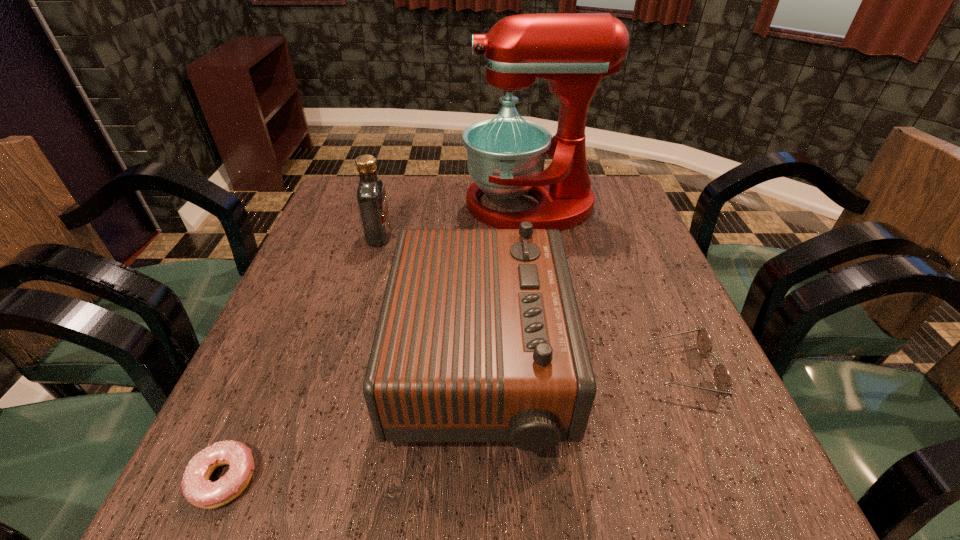
Locate an element on the screen. Image resolution: width=960 pixels, height=540 pixels. vacant position at the far right corner of the desktop is located at coordinates (619, 217).

Image resolution: width=960 pixels, height=540 pixels. Identify the location of vacant area at the near right corner. (734, 505).

I want to click on free space between the second object from left to right and the shortest object, so click(301, 357).

Where is `blank region between the mixer and the vodka`? Image resolution: width=960 pixels, height=540 pixels. blank region between the mixer and the vodka is located at coordinates (455, 221).

Image resolution: width=960 pixels, height=540 pixels. Identify the location of vacant area between the fourth object from right to left and the shortest object. (301, 357).

I want to click on free space that is in between the vodka and the tallest object, so click(455, 221).

Locate an element on the screen. This screenshot has height=540, width=960. free point between the radio receiver and the shortest object is located at coordinates (351, 423).

Where is `free space that is in between the leftmost object and the radio receiver`? This screenshot has height=540, width=960. free space that is in between the leftmost object and the radio receiver is located at coordinates (351, 423).

Find the location of a particular element. vacant space in between the fourth object from right to left and the mixer is located at coordinates (455, 221).

Select which object appears as the third closest to the shortest object. Please provide its 2D coordinates. Your answer should be formatted as a tuple, i.e. [(x, y)], where the tuple contains the x and y coordinates of a point satisfying the conditions above.

[(572, 51)]